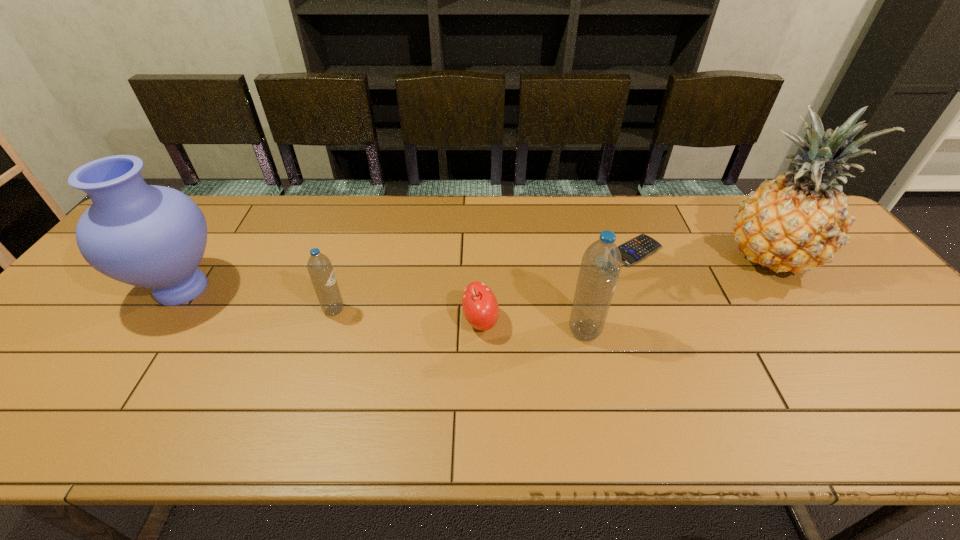
Please point a spot on the right to add another water bottle. Please provide its 2D coordinates. Your answer should be formatted as a tuple, i.e. [(x, y)], where the tuple contains the x and y coordinates of a point satisfying the conditions above.

[(859, 354)]